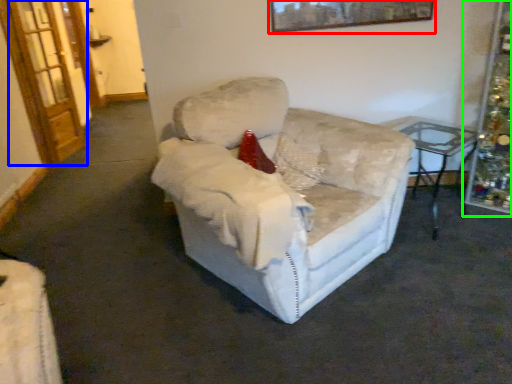
Question: Which object is the closest to the picture frame (highlighted by a red box)? Choose among these: glass door (highlighted by a blue box) or christmas decoration (highlighted by a green box).

Choices:
 (A) glass door
 (B) christmas decoration

Answer: (B)